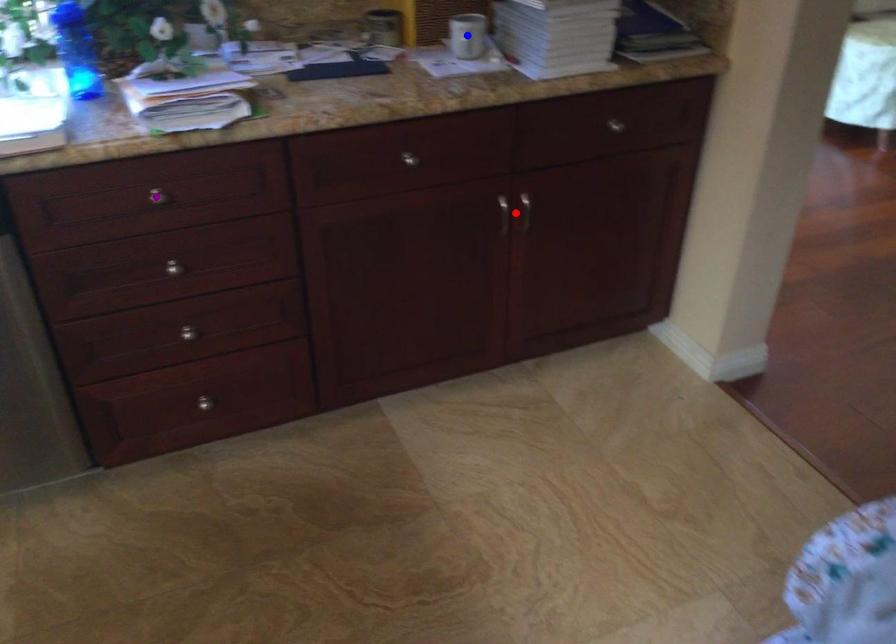
Order these from nearest to farthest:
1. red point
2. blue point
3. purple point

purple point → blue point → red point